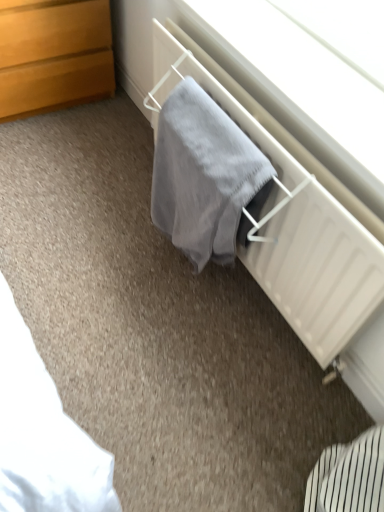
Image resolution: width=384 pixels, height=512 pixels. Describe the element at coordinates (294, 227) in the screenshot. I see `gray fabric at center` at that location.

Find the location of `gray soft towel at center`. gray soft towel at center is located at coordinates (203, 175).

Describe the element at coordinates (203, 175) in the screenshot. I see `gray soft towel at center` at that location.

Identify the location of gray fabric at center. This screenshot has width=384, height=512. (294, 227).

From the image's perspective, does wooden chest of drawers at upper left appear lower than gray soft towel at center?

No, from the image's perspective, wooden chest of drawers at upper left is not beneath gray soft towel at center.

From the picture: Considering the sizes of wooden chest of drawers at upper left and gray soft towel at center in the image, is wooden chest of drawers at upper left wider or thinner than gray soft towel at center?

In the image, wooden chest of drawers at upper left appears to be wider than gray soft towel at center.

Is wooden chest of drawers at upper left surrounding gray soft towel at center?

That's incorrect, gray soft towel at center is not inside wooden chest of drawers at upper left.

Would you say gray soft towel at center contains gray fabric at center?

No, gray fabric at center is located outside of gray soft towel at center.

Does gray soft towel at center touch gray fabric at center?

There is a gap between gray soft towel at center and gray fabric at center.

Considering the relative positions of gray soft towel at center and gray fabric at center in the image provided, is gray soft towel at center to the left or to the right of gray fabric at center?

Based on their positions, gray soft towel at center is located to the left of gray fabric at center.

From the image's perspective, which is below, gray soft towel at center or gray fabric at center?

gray soft towel at center, from the image's perspective.

Between gray fabric at center and gray soft towel at center, which one appears on the right side from the viewer's perspective?

gray fabric at center.

Considering the relative sizes of gray fabric at center and gray soft towel at center in the image provided, is gray fabric at center thinner than gray soft towel at center?

No.

Would you consider gray fabric at center to be distant from gray soft towel at center?

They are positioned close to each other.

Based on the photo, from a real-world perspective, is wooden chest of drawers at upper left positioned under gray fabric at center based on gravity?

Yes, from a real-world perspective, wooden chest of drawers at upper left is below gray fabric at center.

From the image's perspective, which is above, wooden chest of drawers at upper left or gray fabric at center?

wooden chest of drawers at upper left appears higher in the image.

Can you confirm if wooden chest of drawers at upper left is positioned to the left of gray fabric at center?

Indeed, wooden chest of drawers at upper left is positioned on the left side of gray fabric at center.

Where is `radiator on the right of wooden chest of drawers at upper left`? This screenshot has width=384, height=512. radiator on the right of wooden chest of drawers at upper left is located at coordinates [x=294, y=227].

Is gray soft towel at center situated inside wooden chest of drawers at upper left or outside?

gray soft towel at center cannot be found inside wooden chest of drawers at upper left.

Is gray soft towel at center turned away from wooden chest of drawers at upper left?

gray soft towel at center is not turned away from wooden chest of drawers at upper left.

From the image's perspective, is gray soft towel at center located above wooden chest of drawers at upper left?

Actually, gray soft towel at center appears below wooden chest of drawers at upper left in the image.

In the scene shown: Considering the sizes of objects gray soft towel at center and wooden chest of drawers at upper left in the image provided, who is thinner, gray soft towel at center or wooden chest of drawers at upper left?

gray soft towel at center is thinner.

Based on the photo, from a real-world perspective, relative to wooden chest of drawers at upper left, is gray fabric at center vertically above or below?

gray fabric at center is situated higher than wooden chest of drawers at upper left in the real world.

Considering the points (361, 228) and (41, 32), which point is behind, point (361, 228) or point (41, 32)?

Positioned behind is point (41, 32).

Looking at this image, is there a large distance between gray fabric at center and wooden chest of drawers at upper left?

That's not correct — gray fabric at center is a little close to wooden chest of drawers at upper left.

This screenshot has height=512, width=384. Find the location of `bath towel positioned vertically above the wooden chest of drawers at upper left (from a real-world perspective)`. bath towel positioned vertically above the wooden chest of drawers at upper left (from a real-world perspective) is located at coordinates click(203, 175).

Image resolution: width=384 pixels, height=512 pixels. Find the location of `bath towel on the left of gray fabric at center`. bath towel on the left of gray fabric at center is located at coordinates (203, 175).

Estimate the real-world distances between objects in this image. Which object is closer to gray fabric at center, wooden chest of drawers at upper left or gray soft towel at center?

Based on the image, gray soft towel at center appears to be nearer to gray fabric at center.

Which object lies further to the anchor point gray fabric at center, gray soft towel at center or wooden chest of drawers at upper left?

Among the two, wooden chest of drawers at upper left is located further to gray fabric at center.

From the image, which object appears to be nearer to gray soft towel at center, wooden chest of drawers at upper left or gray fabric at center?

Among the two, gray fabric at center is located nearer to gray soft towel at center.

Looking at the image, which one is located further to wooden chest of drawers at upper left, gray fabric at center or gray soft towel at center?

The object further to wooden chest of drawers at upper left is gray soft towel at center.

Based on their spatial positions, is gray fabric at center or wooden chest of drawers at upper left closer to gray soft towel at center?

The object closer to gray soft towel at center is gray fabric at center.

From the image, which object appears to be nearer to wooden chest of drawers at upper left, gray soft towel at center or gray fabric at center?

Among the two, gray fabric at center is located nearer to wooden chest of drawers at upper left.

I want to click on radiator that lies between wooden chest of drawers at upper left and gray soft towel at center from top to bottom, so click(x=294, y=227).